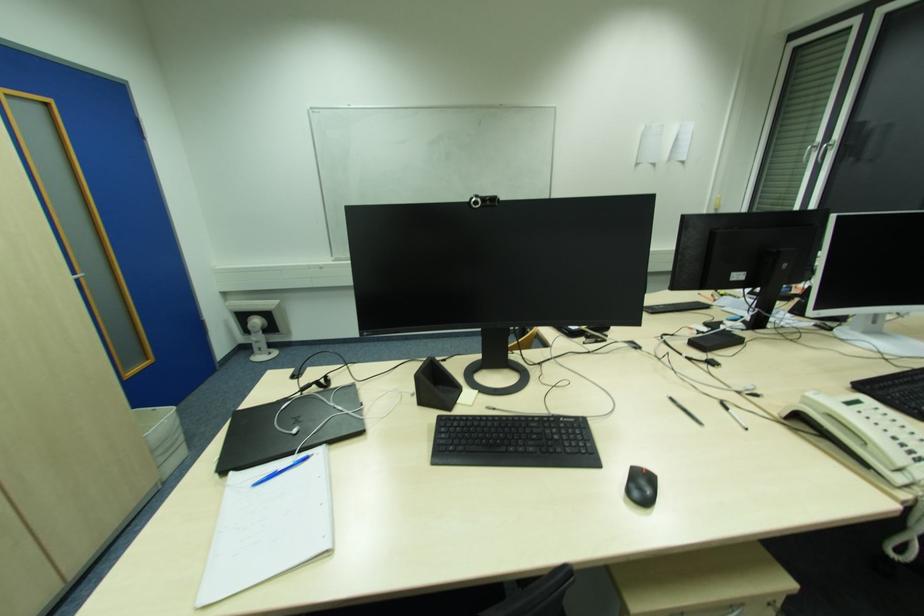
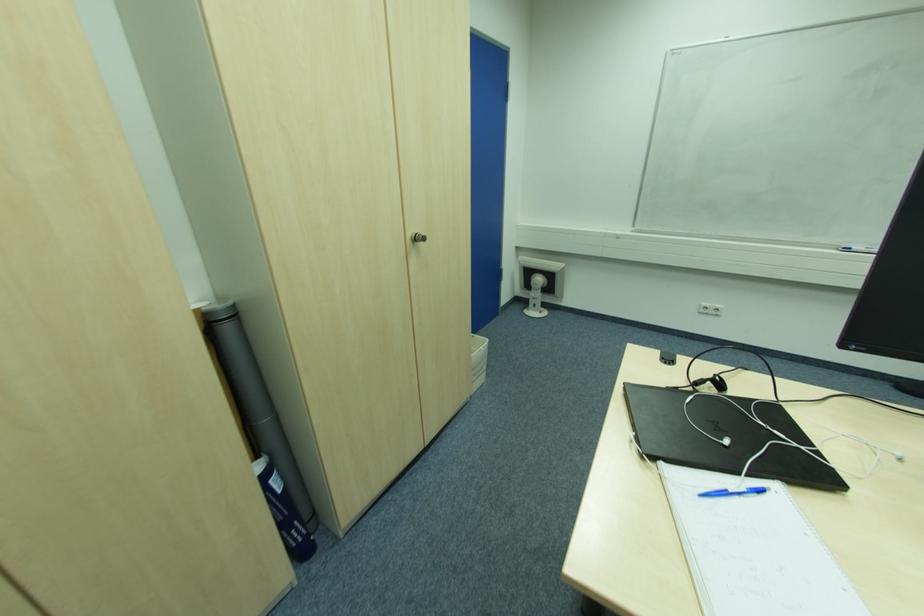
Locate, in the second image, the point that corresponds to the point at 155,411 in the first image.

(475, 338)